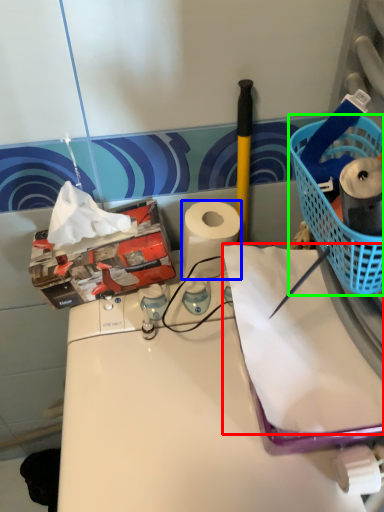
Question: Considering the real-world distances, which object is farthest from paper (highlighted by a red box)? paper towel (highlighted by a blue box) or basket (highlighted by a green box)?

Choices:
 (A) paper towel
 (B) basket

Answer: (A)